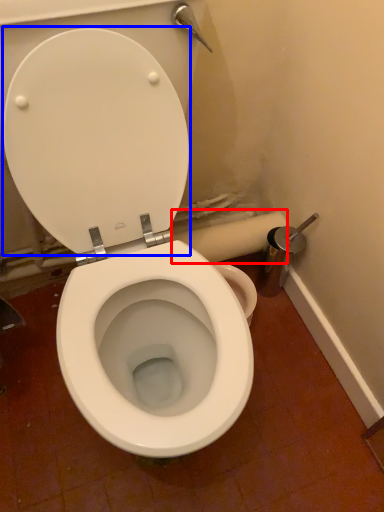
Question: Which of the following is the farthest to the observer, toilet paper (highlighted by a red box) or back (highlighted by a blue box)?

Choices:
 (A) toilet paper
 (B) back

Answer: (A)